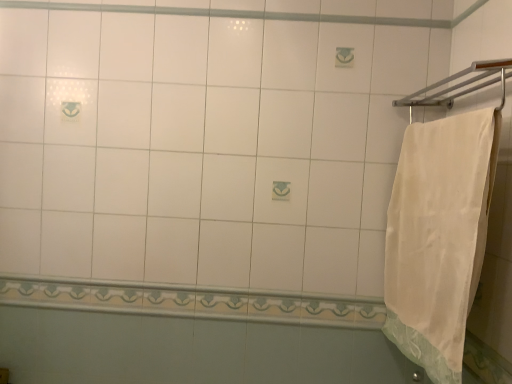
Question: Considering the relative positions of silver metallic towel bar at upper right and white glossy tile at lower center in the image provided, is silver metallic towel bar at upper right to the left or to the right of white glossy tile at lower center?

Choices:
 (A) right
 (B) left

Answer: (A)

Question: Considering the positions of silver metallic towel bar at upper right and white glossy tile at lower center in the image, is silver metallic towel bar at upper right wider or thinner than white glossy tile at lower center?

Choices:
 (A) thin
 (B) wide

Answer: (B)

Question: Which object is positioned farthest from the white glossy tile at lower center?

Choices:
 (A) white cotton towel at right
 (B) silver metallic towel bar at upper right

Answer: (B)

Question: Estimate the real-world distances between objects in this image. Which object is farther from the silver metallic towel bar at upper right?

Choices:
 (A) white glossy tile at lower center
 (B) white cotton towel at right

Answer: (A)